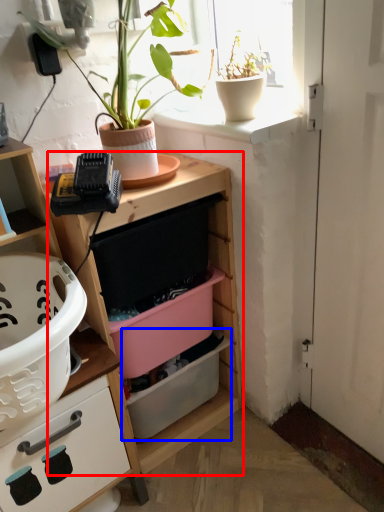
Question: Which object appears closest to the camera in this image, shelf (highlighted by a red box) or storage box (highlighted by a blue box)?

Choices:
 (A) shelf
 (B) storage box

Answer: (A)